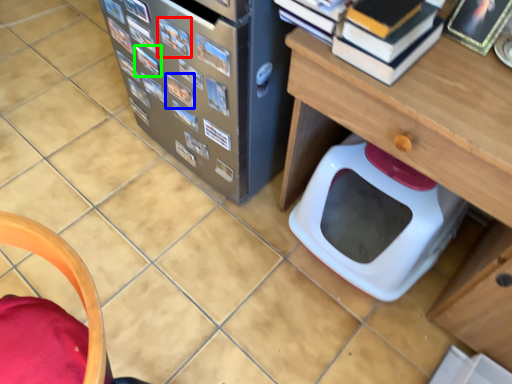
Question: Which is farther away from book (highlighted by a red box)? book (highlighted by a blue box) or book (highlighted by a green box)?

Choices:
 (A) book
 (B) book

Answer: (B)